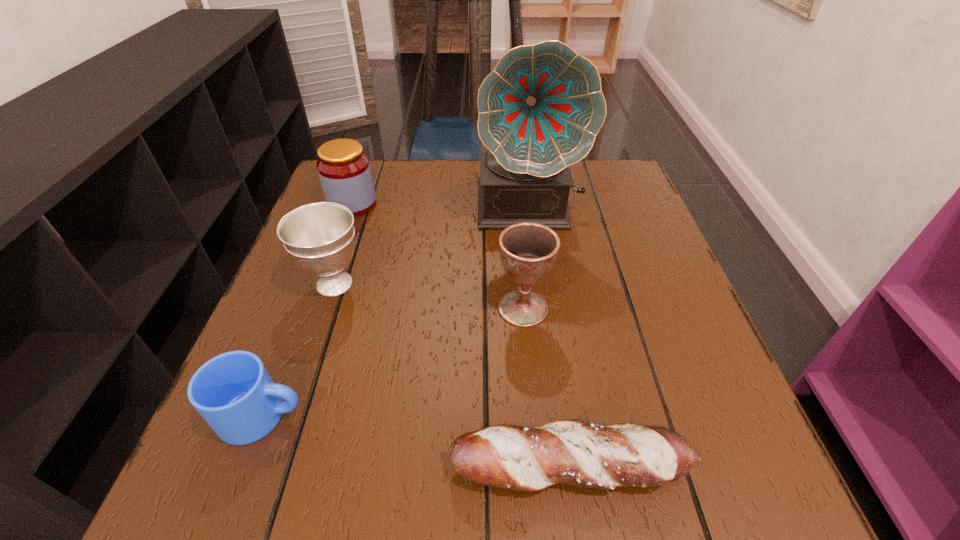
I want to click on object present at the far left corner, so click(x=344, y=170).

Image resolution: width=960 pixels, height=540 pixels. I want to click on object present at the far right corner, so click(539, 111).

Where is `object at the near right corner`? Image resolution: width=960 pixels, height=540 pixels. object at the near right corner is located at coordinates [x=573, y=452].

I want to click on vacant region at the far edge of the desktop, so click(394, 186).

The height and width of the screenshot is (540, 960). In the image, there is a desktop. What are the coordinates of `vacant space at the near edge` in the screenshot? It's located at (324, 484).

The image size is (960, 540). Identify the location of vacant space at the left edge of the desktop. (260, 353).

You are a GUI agent. You are given a task and a screenshot of the screen. Output one action in this format:
    pyautogui.click(x=<x>, y=<y>)
    Task: Click on the vacant point at the right edge
    The height and width of the screenshot is (540, 960).
    Given the screenshot: What is the action you would take?
    pyautogui.click(x=616, y=275)

In the image, there is a desktop. In order to click on free space at the near left corner in this screenshot , I will do `click(254, 486)`.

Where is `vacant space at the far right corner`? This screenshot has width=960, height=540. vacant space at the far right corner is located at coordinates (612, 170).

At what (x,y) coordinates should I click in order to perform the action: click on free spot between the record player and the jar. Please return your answer as a coordinate pair (x, y). This screenshot has height=540, width=960. Looking at the image, I should click on (441, 205).